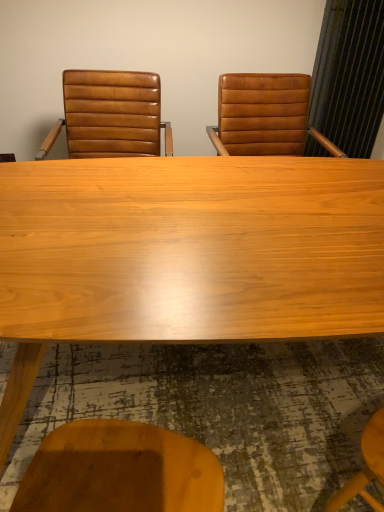
What do you see at coordinates (185, 254) in the screenshot?
I see `light wood table at center` at bounding box center [185, 254].

At what (x,y) coordinates should I click in order to perform the action: click on light wood table at center. Please return your answer as a coordinate pair (x, y). This screenshot has width=384, height=512. Looking at the image, I should click on (185, 254).

Describe the element at coordinates (110, 115) in the screenshot. I see `brown leather chair at left` at that location.

I want to click on brown leather chair at left, so click(x=110, y=115).

What are the coordinates of `light wood table at center` in the screenshot? It's located at (185, 254).

Is brown leather chair at left to the left or to the right of light wood table at center in the image?

Clearly, brown leather chair at left is on the left of light wood table at center in the image.

Which object is more forward, brown leather chair at left or light wood table at center?

light wood table at center is more forward.

Which is behind, point (87, 89) or point (223, 279)?

The point (87, 89) is farther from the camera.

Looking at this image, from the image's perspective, is brown leather chair at left above or below light wood table at center?

brown leather chair at left is situated higher than light wood table at center in the image.

In the scene shown: From a real-world perspective, which object rests below the other?

From a 3D spatial view, light wood table at center is below.

Is brown leather chair at left thinner than light wood table at center?

Yes.

Does brown leather chair at left have a greater height compared to light wood table at center?

Incorrect, the height of brown leather chair at left is not larger of that of light wood table at center.

Considering the relative sizes of brown leather chair at left and light wood table at center in the image provided, is brown leather chair at left smaller than light wood table at center?

Correct, brown leather chair at left occupies less space than light wood table at center.

Is light wood table at center surrounded by brown leather chair at left?

No, light wood table at center is located outside of brown leather chair at left.

Would you consider brown leather chair at left to be distant from light wood table at center?

No, there isn't a large distance between brown leather chair at left and light wood table at center.

Is brown leather chair at left looking in the opposite direction of light wood table at center?

brown leather chair at left does not have its back to light wood table at center.

Can you tell me how much brown leather chair at left and light wood table at center differ in facing direction?

They differ by 2.74 degrees in their facing directions.

Measure the distance from brown leather chair at left to light wood table at center.

brown leather chair at left is 33.45 inches from light wood table at center.

You are a GUI agent. You are given a task and a screenshot of the screen. Output one action in this format:
    pyautogui.click(x=<x>, y=<y>)
    Task: Click on the chair that appears behind the light wood table at center
    This screenshot has width=384, height=512.
    Given the screenshot: What is the action you would take?
    110,115

Would you say light wood table at center is to the left or to the right of brown leather chair at left in the picture?

Based on their positions, light wood table at center is located to the right of brown leather chair at left.

Consider the image. Is light wood table at center in front of or behind brown leather chair at left in the image?

light wood table at center is positioned closer to the viewer than brown leather chair at left.

Is point (280, 163) closer or farther from the camera than point (55, 131)?

Point (280, 163).

From the image's perspective, is light wood table at center on brown leather chair at left?

Incorrect, from the image's perspective, light wood table at center is lower than brown leather chair at left.

Based on the photo, from a real-world perspective, does light wood table at center stand above brown leather chair at left?

No, from a real-world perspective, light wood table at center is not over brown leather chair at left

Can you confirm if light wood table at center is wider than brown leather chair at left?

Correct, the width of light wood table at center exceeds that of brown leather chair at left.

Is light wood table at center shorter than brown leather chair at left?

No.

Considering the relative sizes of light wood table at center and brown leather chair at left in the image provided, is light wood table at center smaller than brown leather chair at left?

No.

Is brown leather chair at left completely or partially inside light wood table at center?

That's incorrect, brown leather chair at left is not inside light wood table at center.

Is light wood table at center placed right next to brown leather chair at left?

No, light wood table at center is not next to brown leather chair at left.

Could you tell me if light wood table at center is facing brown leather chair at left?

No, light wood table at center is not aimed at brown leather chair at left.

What's the angular difference between light wood table at center and brown leather chair at left's facing directions?

2.74 degrees separate the facing orientations of light wood table at center and brown leather chair at left.

How distant is light wood table at center from brown leather chair at left?

84.96 centimeters.

I want to click on chair above the light wood table at center (from a real-world perspective), so click(x=110, y=115).

You are a GUI agent. You are given a task and a screenshot of the screen. Output one action in this format:
    pyautogui.click(x=<x>, y=<y>)
    Task: Click on the table beneath the brown leather chair at left (from a real-world perspective)
    
    Given the screenshot: What is the action you would take?
    pyautogui.click(x=185, y=254)

The image size is (384, 512). What are the coordinates of `chair to the left of light wood table at center` in the screenshot? It's located at (110, 115).